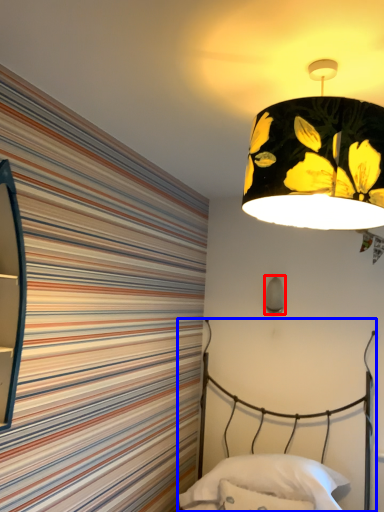
Question: Which of the following is the closest to the observer, lamp (highlighted by a red box) or bed (highlighted by a blue box)?

Choices:
 (A) lamp
 (B) bed

Answer: (B)